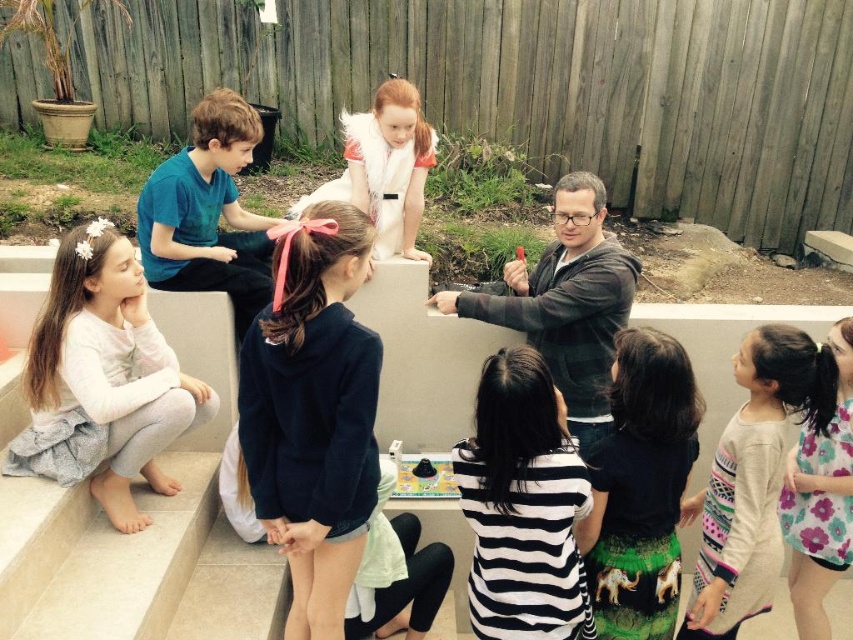
Question: Estimate the real-world distances between objects in this image. Which object is closer to the striped cotton shirt at lower right?

Choices:
 (A) gray cotton dress at lower left
 (B) black and white striped shirt at center
 (C) dark blue fleece at center

Answer: (B)

Question: Can you confirm if dark blue fleece at center is smaller than white fluffy vest at center?

Choices:
 (A) no
 (B) yes

Answer: (A)

Question: Is black and white striped shirt at center to the left of gray fleece jacket at center from the viewer's perspective?

Choices:
 (A) yes
 (B) no

Answer: (A)

Question: Does gray cotton dress at lower left have a larger size compared to black and white striped shirt at center?

Choices:
 (A) no
 (B) yes

Answer: (B)

Question: Which object is closer to the camera taking this photo?

Choices:
 (A) floral-patterned shirt at lower right
 (B) white fluffy vest at center
 (C) gray cotton dress at lower left
 (D) black and white striped shirt at center

Answer: (D)

Question: Which point is farther to the camera?

Choices:
 (A) (844, 509)
 (B) (354, 364)
 (C) (747, 355)

Answer: (A)